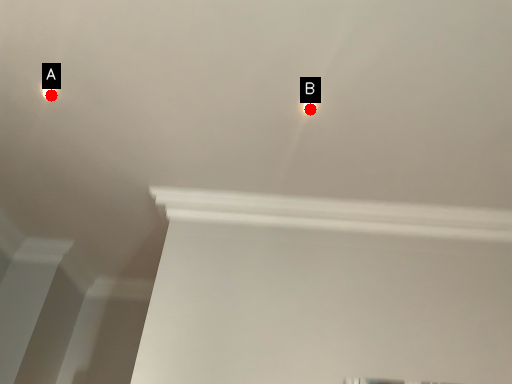
Question: Two points are circled on the image, labeled by A and B beside each circle. Which point appears closest to the camera in this image?

Choices:
 (A) A is closer
 (B) B is closer

Answer: (B)